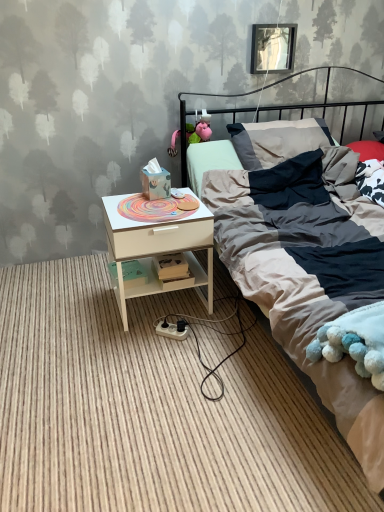
Question: Looking at their shapes, would you say white wood nightstand at lower left is wider or thinner than textured cotton bed at center?

Choices:
 (A) wide
 (B) thin

Answer: (B)

Question: Is white wood nightstand at lower left bigger or smaller than textured cotton bed at center?

Choices:
 (A) big
 (B) small

Answer: (B)

Question: Which object is positioned farthest from the metallic rectangular frame at upper center?

Choices:
 (A) white wood nightstand at lower left
 (B) textured cotton bed at center
 (C) white wood nightstand at lower left

Answer: (A)

Question: Which object is the closest to the white wood nightstand at lower left?

Choices:
 (A) white wood nightstand at lower left
 (B) metallic rectangular frame at upper center
 (C) textured cotton bed at center

Answer: (C)